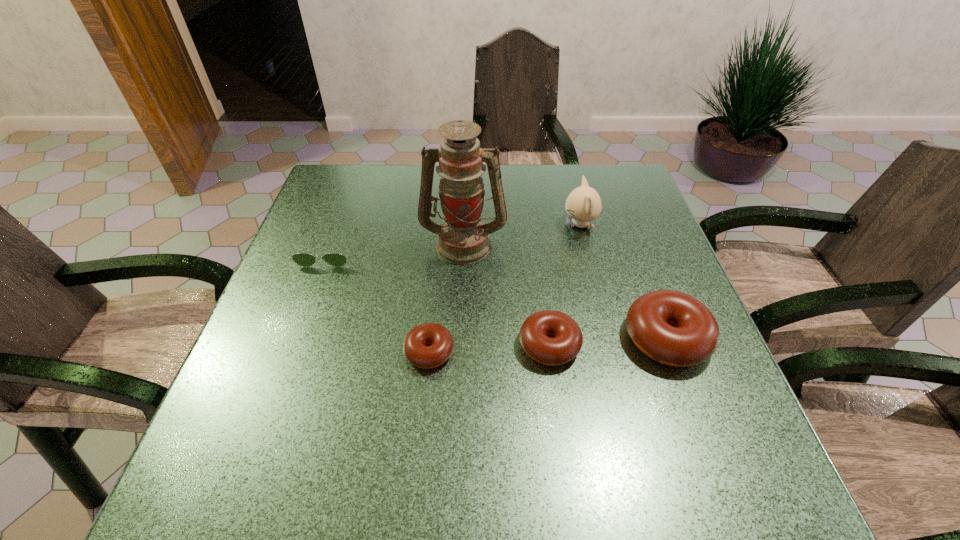
Where is `vacant point located between the third object from right to left and the shortest doughnut`? vacant point located between the third object from right to left and the shortest doughnut is located at coordinates (490, 348).

Where is `free spot between the shortest doughnut and the kitten`? This screenshot has height=540, width=960. free spot between the shortest doughnut and the kitten is located at coordinates (504, 288).

The image size is (960, 540). Find the location of `free space that is in between the fifth shortest object and the second tallest doughnut`. free space that is in between the fifth shortest object and the second tallest doughnut is located at coordinates (x=564, y=285).

Find the location of a particular element. The height and width of the screenshot is (540, 960). empty space between the leftmost doughnut and the sunglasses is located at coordinates point(379,301).

This screenshot has height=540, width=960. I want to click on object that stands as the closest to the fourth object from left to right, so click(x=671, y=327).

Image resolution: width=960 pixels, height=540 pixels. What are the coordinates of `object that can be found as the fifth closest to the sunglasses` in the screenshot? It's located at (671, 327).

Point out which doughnut is positioned as the second nearest to the tallest doughnut. Please provide its 2D coordinates. Your answer should be formatted as a tuple, i.e. [(x, y)], where the tuple contains the x and y coordinates of a point satisfying the conditions above.

[(415, 350)]

Locate an element on the screen. doughnut object that ranks as the closest to the rightmost doughnut is located at coordinates (568, 339).

Find the location of a particular element. vacant space that satisfies the following two spatial constraints: 1. on the back side of the third shortest object; 2. on the left side of the tallest doughnut is located at coordinates (548, 339).

Find the location of a particular element. vacant position in the image that satisfies the following two spatial constraints: 1. on the front-facing side of the fourth object from left to right; 2. on the right side of the sunglasses is located at coordinates (294, 345).